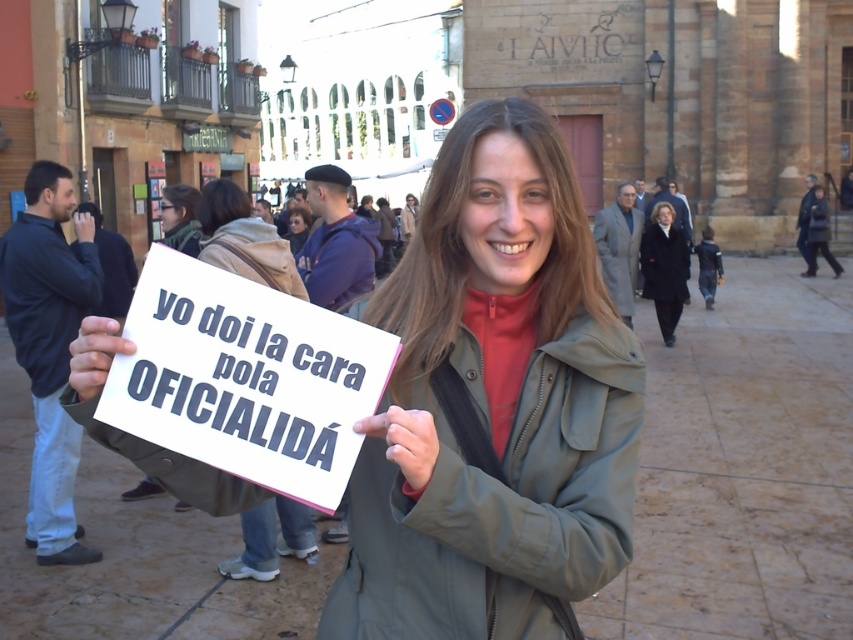
Question: Based on their relative distances, which object is nearer to the matte green jacket at center?

Choices:
 (A) dark brown hair at center
 (B) white paper sign at center
 (C) dark blue coat at upper right

Answer: (B)

Question: Among these points, which one is farthest from the camera?

Choices:
 (A) (300, 241)
 (B) (646, 234)
 (C) (585, 326)

Answer: (A)

Question: Can you confirm if matte green jacket at center is positioned above dark brown hair at center?

Choices:
 (A) no
 (B) yes

Answer: (A)

Question: Which is nearer to the dark brown hair at center?

Choices:
 (A) matte green jacket at center
 (B) dark blue coat at upper right

Answer: (B)

Question: Does white paper sign at center have a greater width compared to dark brown hair at center?

Choices:
 (A) yes
 (B) no

Answer: (A)

Question: Is matte green jacket at center above dark brown hair at center?

Choices:
 (A) no
 (B) yes

Answer: (A)